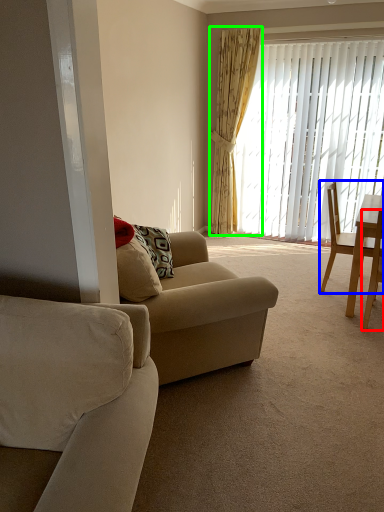
Question: Which is nearer to the chair (highlighted by a red box)? chair (highlighted by a blue box) or curtain (highlighted by a green box).

Choices:
 (A) chair
 (B) curtain

Answer: (A)